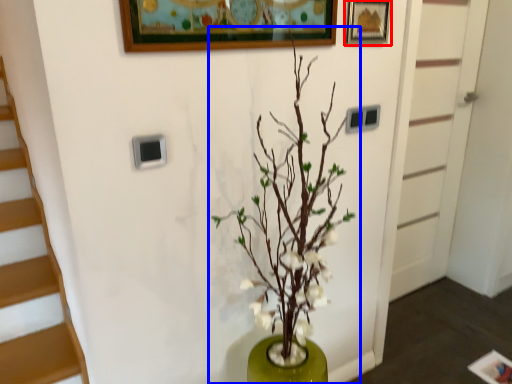
Question: Which point is further to the camera, picture frame (highlighted by a red box) or houseplant (highlighted by a blue box)?

Choices:
 (A) picture frame
 (B) houseplant

Answer: (A)